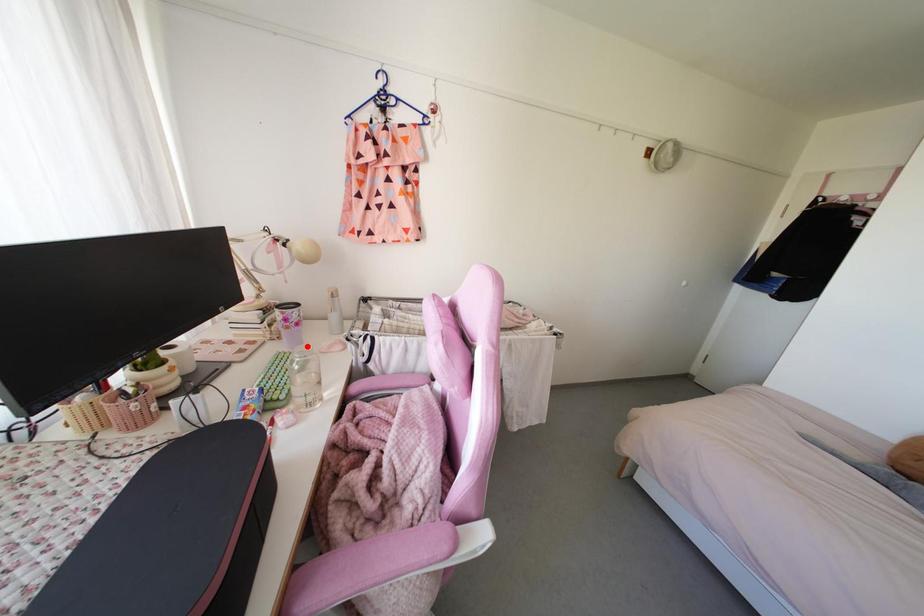
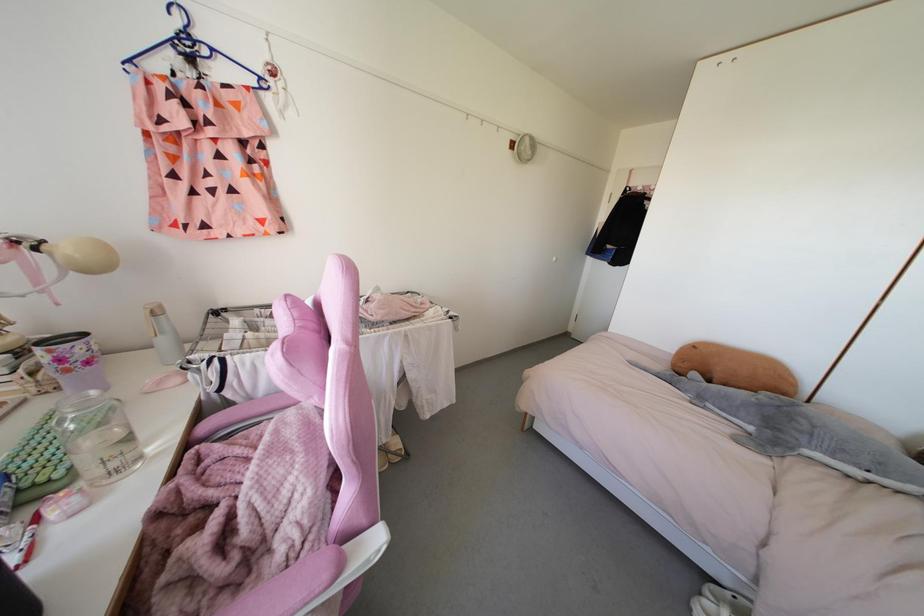
Locate, in the second image, the point that corresponds to the highlighted location in the first image.

(92, 392)